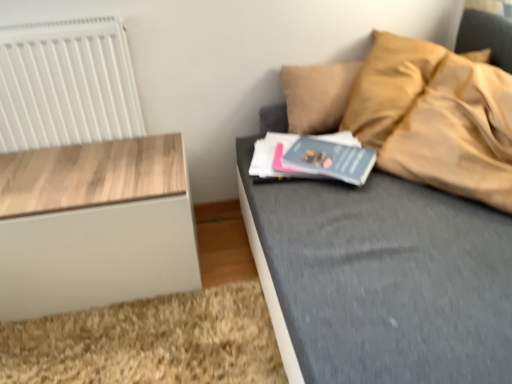
Question: Does wooden nightstand at left have a lesser width compared to white plastic radiator at upper left?

Choices:
 (A) no
 (B) yes

Answer: (A)

Question: Is white plastic radiator at upper left surrounded by wooden nightstand at left?

Choices:
 (A) no
 (B) yes

Answer: (A)

Question: From a real-world perspective, is wooden nightstand at left on white plastic radiator at upper left?

Choices:
 (A) no
 (B) yes

Answer: (A)

Question: Is wooden nightstand at left with white plastic radiator at upper left?

Choices:
 (A) yes
 (B) no

Answer: (B)

Question: Is wooden nightstand at left outside white plastic radiator at upper left?

Choices:
 (A) yes
 (B) no

Answer: (A)

Question: Is wooden nightstand at left in front of or behind white plastic radiator at upper left in the image?

Choices:
 (A) behind
 (B) front

Answer: (B)

Question: Would you say wooden nightstand at left is inside or outside white plastic radiator at upper left?

Choices:
 (A) inside
 (B) outside

Answer: (B)

Question: Does point (159, 288) appear closer or farther from the camera than point (51, 54)?

Choices:
 (A) farther
 (B) closer

Answer: (A)

Question: From the image's perspective, relative to white plastic radiator at upper left, is wooden nightstand at left above or below?

Choices:
 (A) above
 (B) below

Answer: (B)

Question: Is white plastic radiator at upper left taller or shorter than wooden nightstand at left?

Choices:
 (A) short
 (B) tall

Answer: (B)

Question: Based on their sizes in the image, would you say white plastic radiator at upper left is bigger or smaller than wooden nightstand at left?

Choices:
 (A) big
 (B) small

Answer: (B)

Question: From a real-world perspective, is white plastic radiator at upper left physically located above or below wooden nightstand at left?

Choices:
 (A) below
 (B) above

Answer: (B)

Question: Looking at their shapes, would you say white plastic radiator at upper left is wider or thinner than wooden nightstand at left?

Choices:
 (A) wide
 (B) thin

Answer: (B)

Question: Considering the positions of point (87, 69) and point (313, 157), is point (87, 69) closer or farther from the camera than point (313, 157)?

Choices:
 (A) closer
 (B) farther

Answer: (B)

Question: Considering the positions of white plastic radiator at upper left and gray matte book at center in the image, is white plastic radiator at upper left wider or thinner than gray matte book at center?

Choices:
 (A) wide
 (B) thin

Answer: (B)